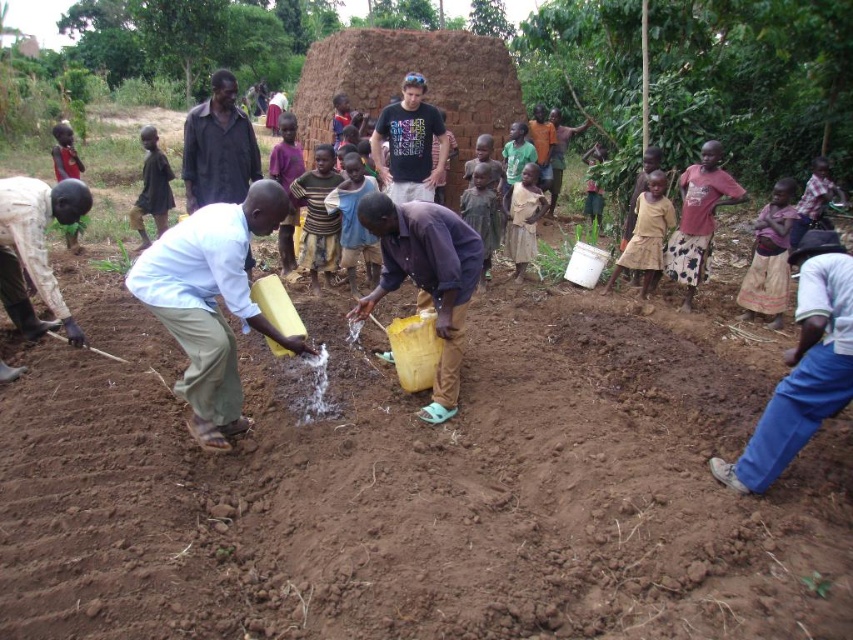
You are a photographer trying to capture the scene. You notice the dark brown shirt at center and the brown textured dress at right. Which clothing item is covering part of the other?

The dark brown shirt at center is positioned over the brown textured dress at right, so it is covering part of it.

You are a photographer trying to capture the scene. You want to ensure both the dark brown shirt at center and the brown textured dress at right are clearly visible in your photo. Since you can only focus on one subject at a time, which one should you choose to ensure the other is still recognizable?

The dark brown shirt at center is bigger than the brown textured dress at right, so focusing on the dark brown shirt at center would allow the smaller brown textured dress at right to still be recognizable in the photo.